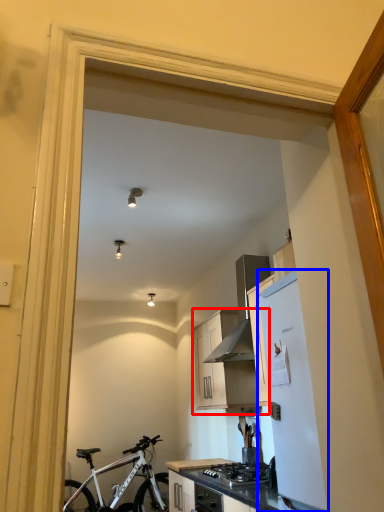
Question: Which point is further to the camera, cabinetry (highlighted by a red box) or refrigerator (highlighted by a blue box)?

Choices:
 (A) cabinetry
 (B) refrigerator

Answer: (A)